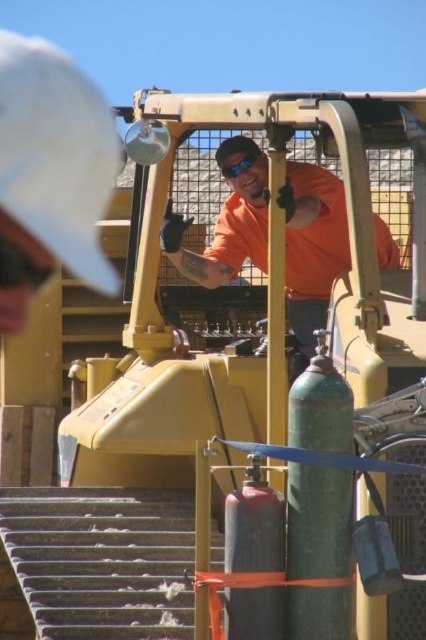
Can you confirm if white fabric cap at upper left is thinner than orange fabric shirt at center?

In fact, white fabric cap at upper left might be wider than orange fabric shirt at center.

Does point (68, 248) come in front of point (302, 301)?

No.

The image size is (426, 640). What do you see at coordinates (55, 152) in the screenshot?
I see `white fabric cap at upper left` at bounding box center [55, 152].

This screenshot has height=640, width=426. Identify the location of white fabric cap at upper left. (55, 152).